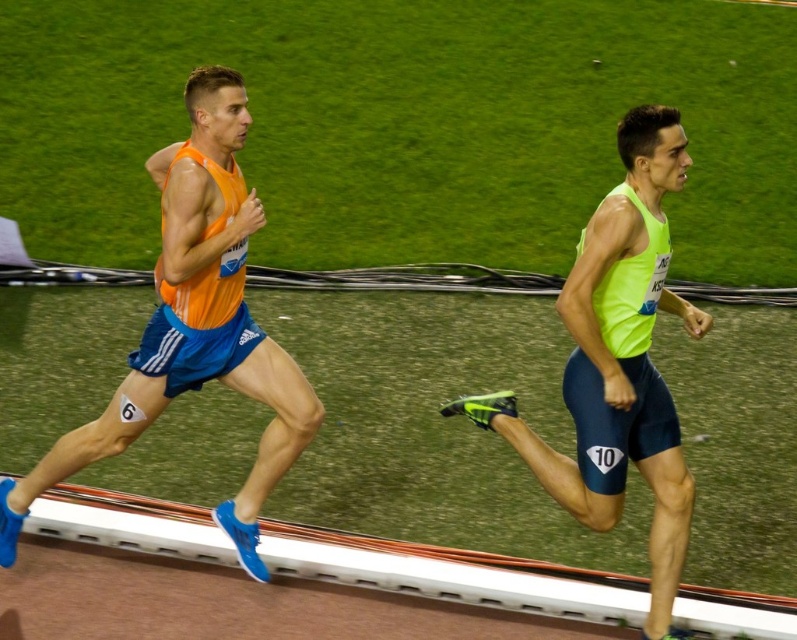
You are a photographer trying to capture the two athletes in the image. You want to adjust your camera settings so that both the matte orange tank top at left and the neon green fabric shorts at right are in focus. Which object should you focus on first to ensure both are sharp?

The matte orange tank top at left is much taller than the neon green fabric shorts at right. To ensure both are in focus, you should focus on the matte orange tank top at left first since it is farther away, allowing the depth of field to cover the closer neon green fabric shorts at right.

You are a photographer standing at the starting line of the track event. You want to take a photo of the athlete wearing the matte orange tank top at left. Where should you aim your camera to capture him in the frame?

The matte orange tank top at left is located at coordinates point 0.509 on the horizontal axis and 0.245 on the vertical axis, so you should aim your camera towards the lower middle area of the image to capture him.